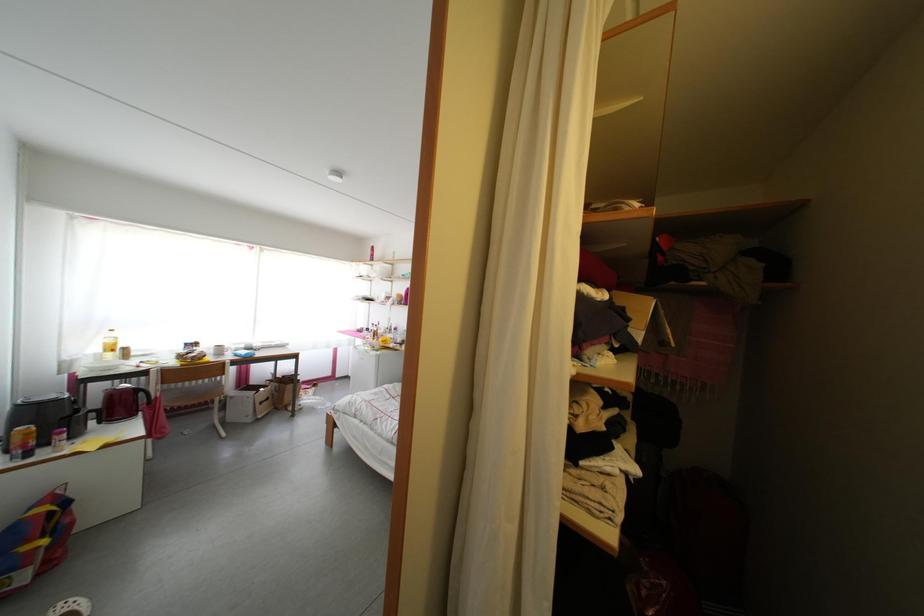
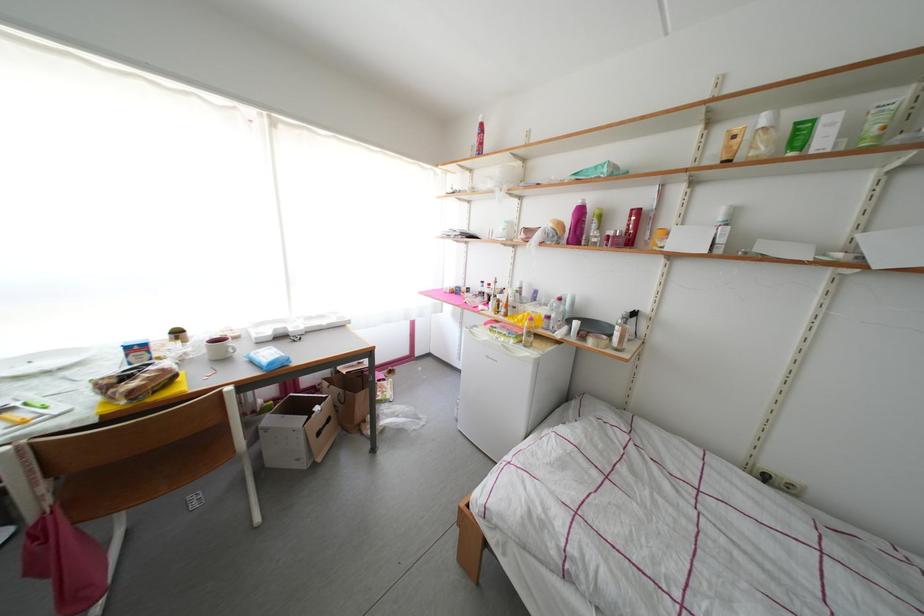
What movement of the cameraman would produce the second image?

The cameraman moved toward left, forward.